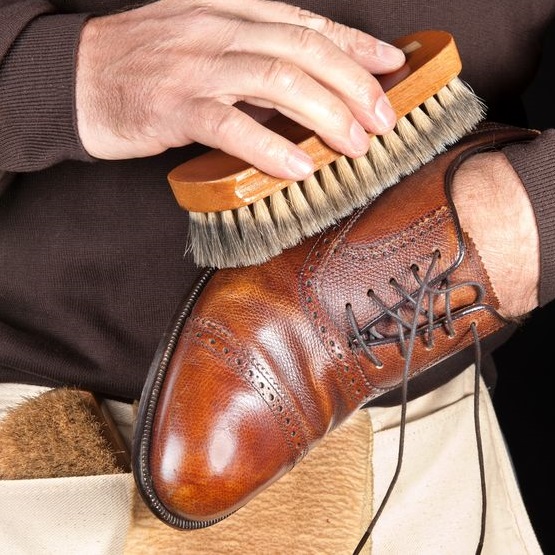
You are a GUI agent. You are given a task and a screenshot of the screen. Output one action in this format:
    pyautogui.click(x=<x>, y=<y>)
    Task: Click on the wooden handle
    
    Given the screenshot: What is the action you would take?
    pyautogui.click(x=416, y=92)